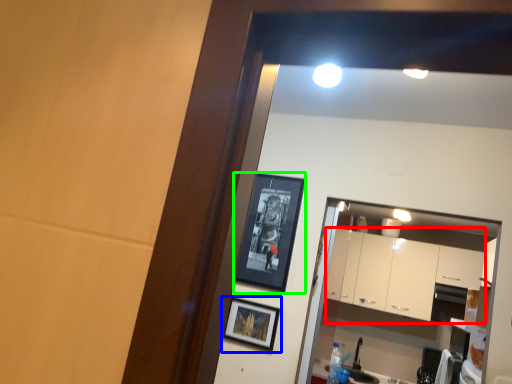
Question: Which object is the farthest from cabinetry (highlighted by a red box)? Choose among these: picture frame (highlighted by a blue box) or picture frame (highlighted by a green box).

Choices:
 (A) picture frame
 (B) picture frame

Answer: (A)